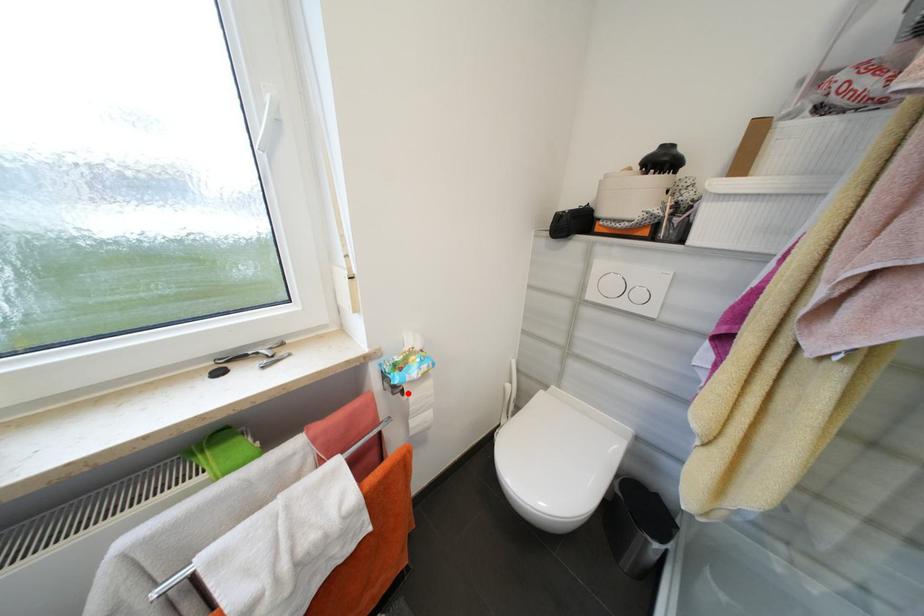
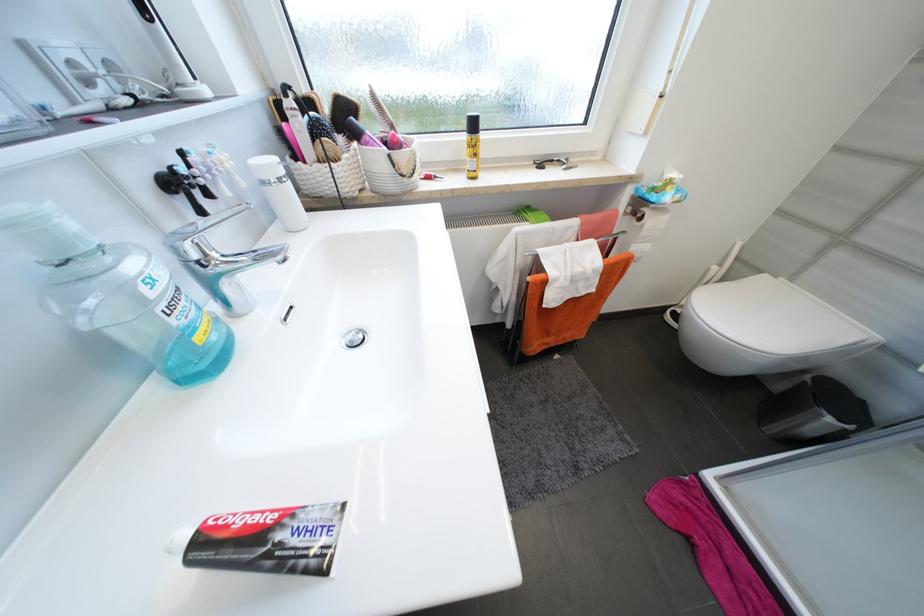
Where in the second image is the point corresponding to the highlighted location from the first image?

(647, 219)